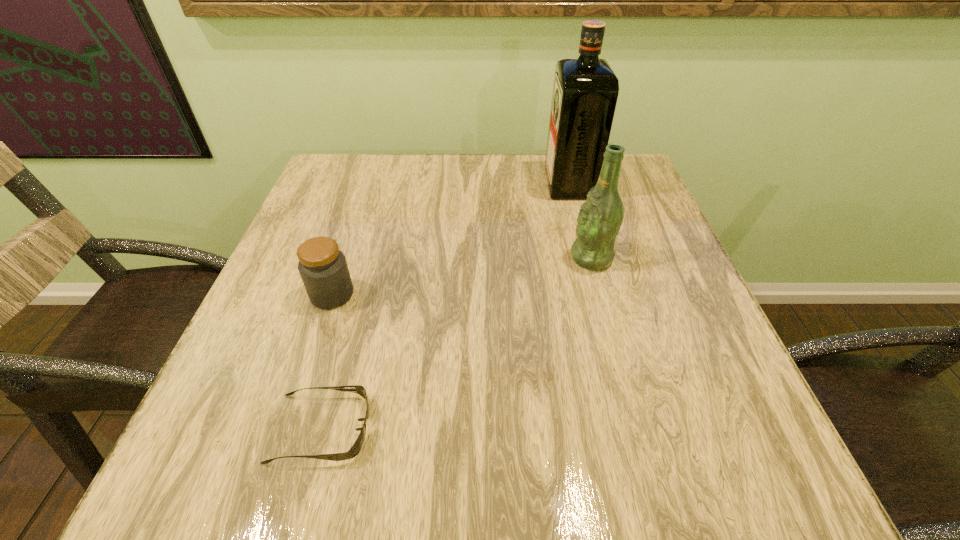
Where is `vacant area situated 0.270m on the front label of the liquor`? The width and height of the screenshot is (960, 540). vacant area situated 0.270m on the front label of the liquor is located at coordinates (444, 184).

Identify the location of free space located on the surface of the second farthest object. (397, 258).

Where is `free space located 0.240m on the surface of the second farthest object`? The height and width of the screenshot is (540, 960). free space located 0.240m on the surface of the second farthest object is located at coordinates (458, 258).

Where is `vacant space located on the surface of the second farthest object`? The width and height of the screenshot is (960, 540). vacant space located on the surface of the second farthest object is located at coordinates (491, 258).

Locate an element on the screen. The width and height of the screenshot is (960, 540). vacant space situated 0.190m on the surface of the second shortest object near the warning symbol is located at coordinates (450, 294).

Find the location of a particular element. vacant region located on the front-facing side of the sunglasses is located at coordinates (614, 428).

Where is `object present at the far edge`? This screenshot has height=540, width=960. object present at the far edge is located at coordinates (585, 91).

I want to click on object present at the near edge, so click(x=355, y=449).

Identify the location of jar that is at the left edge. (322, 266).

The image size is (960, 540). What are the coordinates of `sunglasses at the left edge` in the screenshot? It's located at (355, 449).